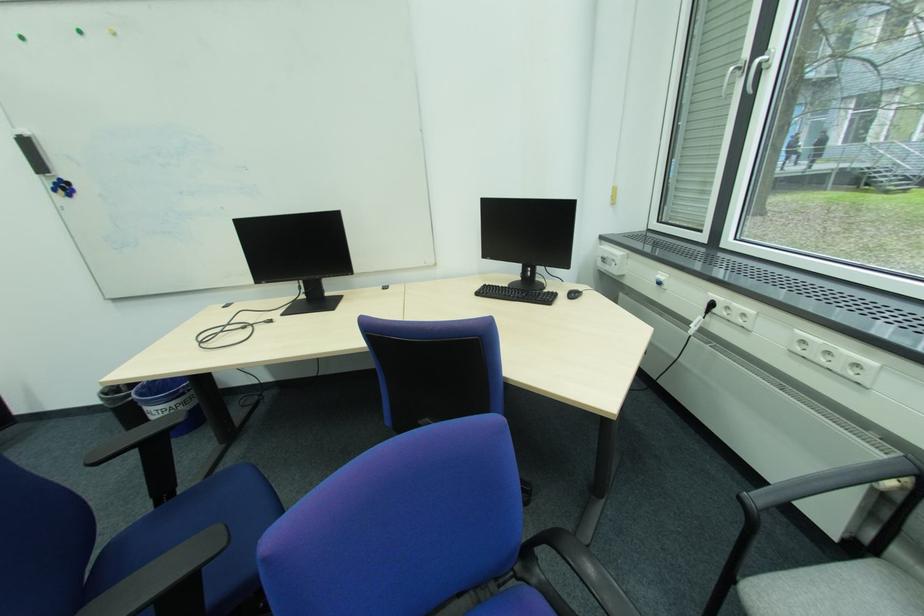
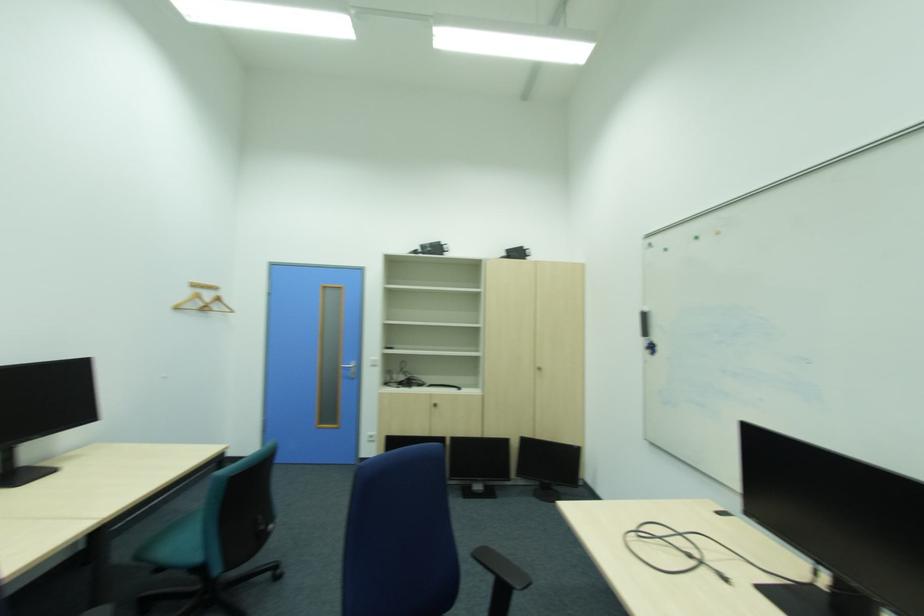
Question: The camera is either moving clockwise (left) or counter-clockwise (right) around the object. The first image is from the beginning of the video and the second image is from the end. Is the camera moving left or right when shooting the video?

Choices:
 (A) Left
 (B) Right

Answer: (B)